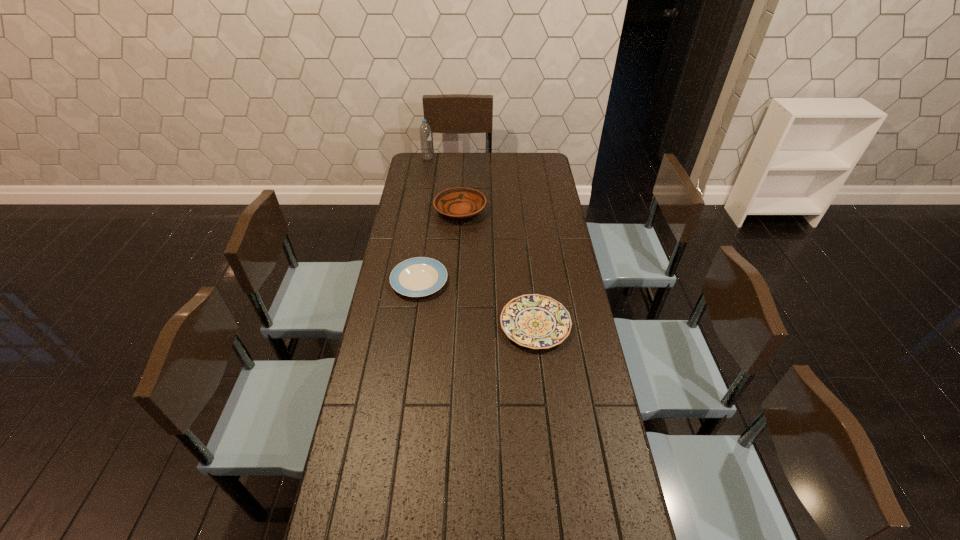
Where is `the closest object to the rightmost object`? The width and height of the screenshot is (960, 540). the closest object to the rightmost object is located at coordinates (421, 276).

Where is `object that can be found as the third closest to the third nearest object`? object that can be found as the third closest to the third nearest object is located at coordinates (534, 321).

Select which plate appears as the second closest to the tallest plate. Please provide its 2D coordinates. Your answer should be formatted as a tuple, i.e. [(x, y)], where the tuple contains the x and y coordinates of a point satisfying the conditions above.

[(534, 321)]

Locate an element on the screen. The width and height of the screenshot is (960, 540). plate that is the second closest one to the tallest plate is located at coordinates [534, 321].

Identify the location of vacant area in the image that satisfies the following two spatial constraints: 1. on the front side of the third shortest object; 2. on the right side of the rightmost plate. This screenshot has height=540, width=960. (454, 325).

Find the location of `free space that satisfies the following two spatial constraints: 1. on the front side of the second farthest object; 2. on the right side of the rightmost plate`. free space that satisfies the following two spatial constraints: 1. on the front side of the second farthest object; 2. on the right side of the rightmost plate is located at coordinates (454, 325).